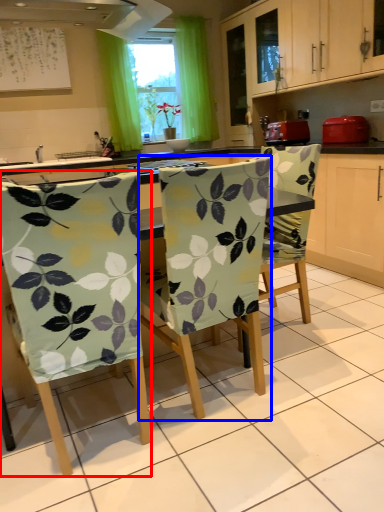
Question: Among these objects, which one is nearest to the camera, chair (highlighted by a red box) or chair (highlighted by a blue box)?

Choices:
 (A) chair
 (B) chair

Answer: (A)